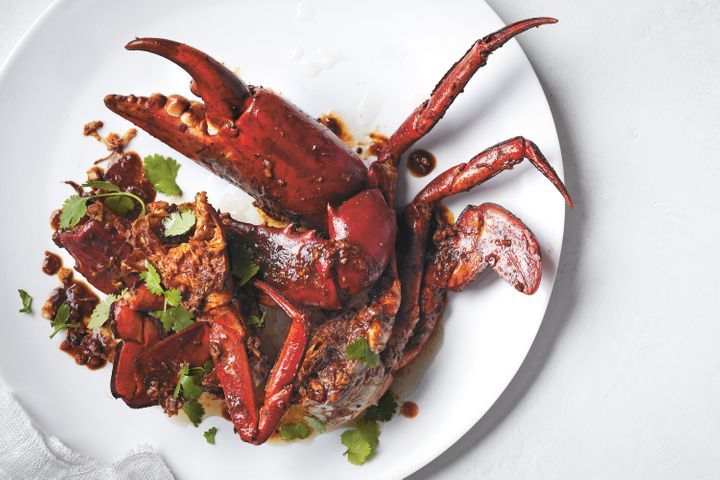
This screenshot has width=720, height=480. Find the location of `white cloth`. white cloth is located at coordinates (24, 462).